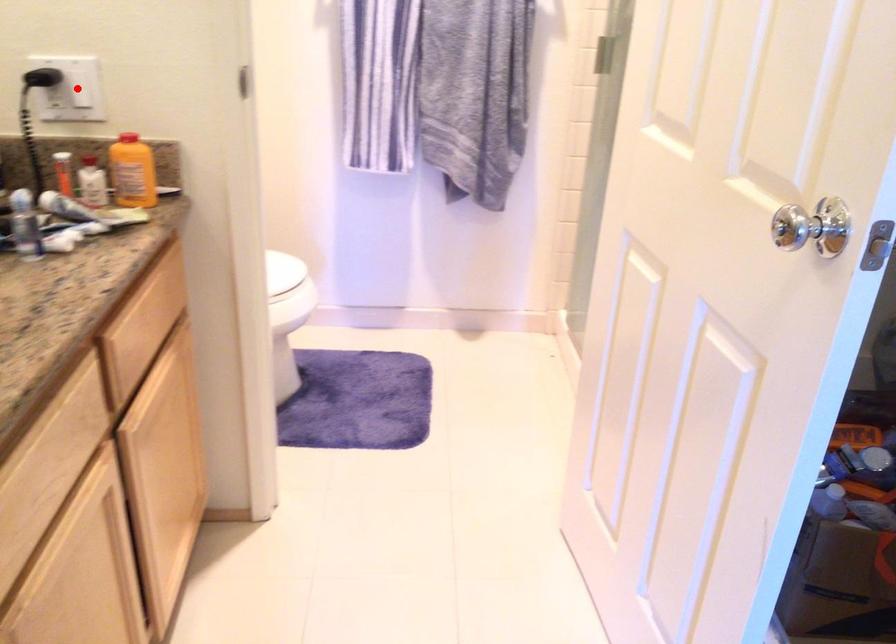
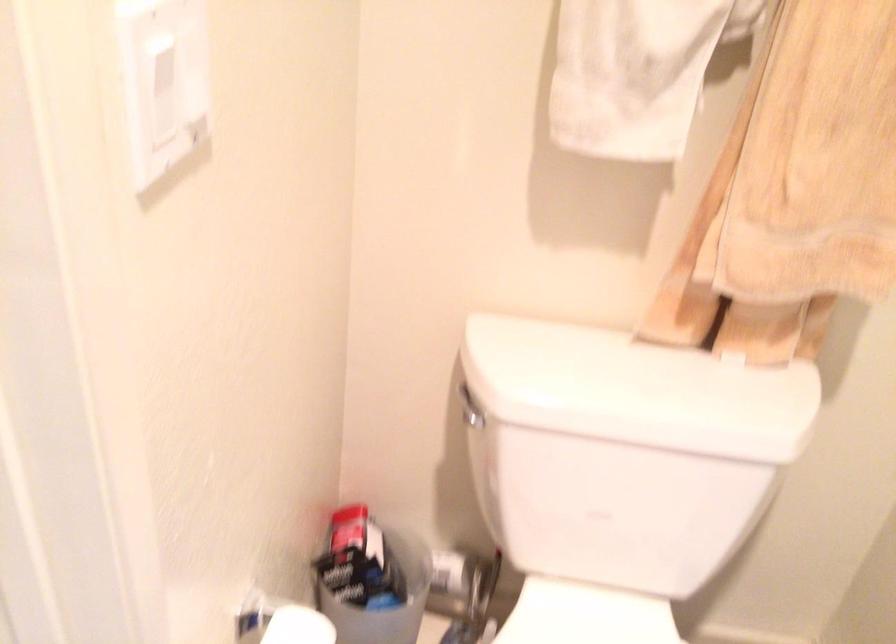
Question: I am providing you with two images of the same scene from different viewpoints. A red point is marked on the first image. Is the red point's position out of view in image 2?

Choices:
 (A) Yes
 (B) No

Answer: (A)